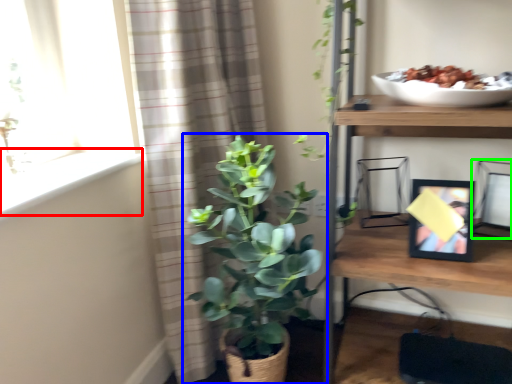
Question: Which is farther away from window sill (highlighted by a red box)? houseplant (highlighted by a blue box) or picture frame (highlighted by a green box)?

Choices:
 (A) houseplant
 (B) picture frame

Answer: (B)